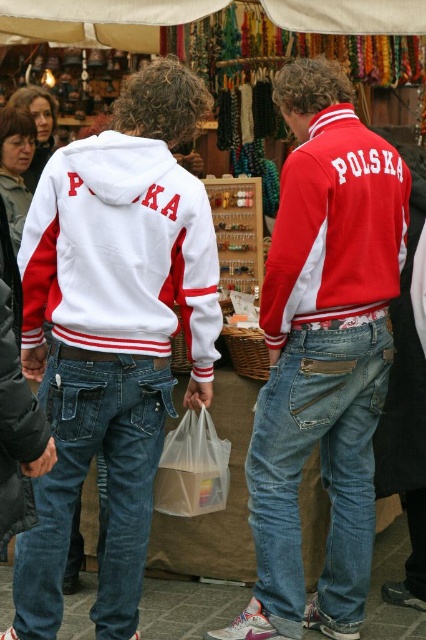
Question: Is denim at left above red matte jacket at center?

Choices:
 (A) no
 (B) yes

Answer: (A)

Question: Is denim at center thinner than white matte jacket at center?

Choices:
 (A) yes
 (B) no

Answer: (B)

Question: Which object is farther from the camera taking this photo?

Choices:
 (A) white matte sweatshirt at center
 (B) matte red jacket at center
 (C) red matte jacket at center

Answer: (B)

Question: Which of the following is the farthest from the observer?

Choices:
 (A) (310, 344)
 (B) (86, 312)
 (C) (342, 196)

Answer: (A)

Question: Does white matte sweatshirt at center have a larger size compared to denim at center?

Choices:
 (A) yes
 (B) no

Answer: (A)

Question: Which point is farther to the camera?

Choices:
 (A) (16, 476)
 (B) (356, 336)
 (C) (89, 400)
 (D) (158, 266)

Answer: (B)